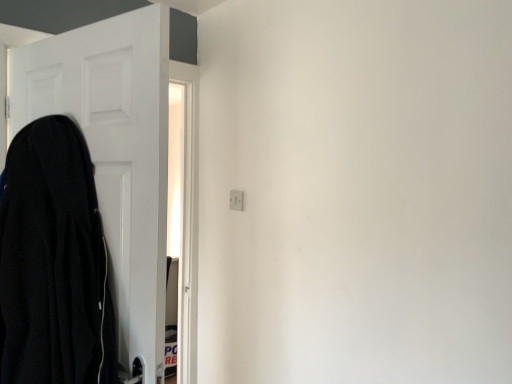
Question: In terms of width, does white plastic electric outlet at upper center look wider or thinner when compared to white matte door at left?

Choices:
 (A) wide
 (B) thin

Answer: (B)

Question: Is point (229, 203) positioned closer to the camera than point (115, 43)?

Choices:
 (A) farther
 (B) closer

Answer: (A)

Question: Estimate the real-world distances between objects in this image. Which object is closer to the black matte coat at left?

Choices:
 (A) white matte door at left
 (B) white plastic electric outlet at upper center

Answer: (A)

Question: Based on their relative distances, which object is farther from the white plastic electric outlet at upper center?

Choices:
 (A) black matte coat at left
 (B) white matte door at left

Answer: (A)